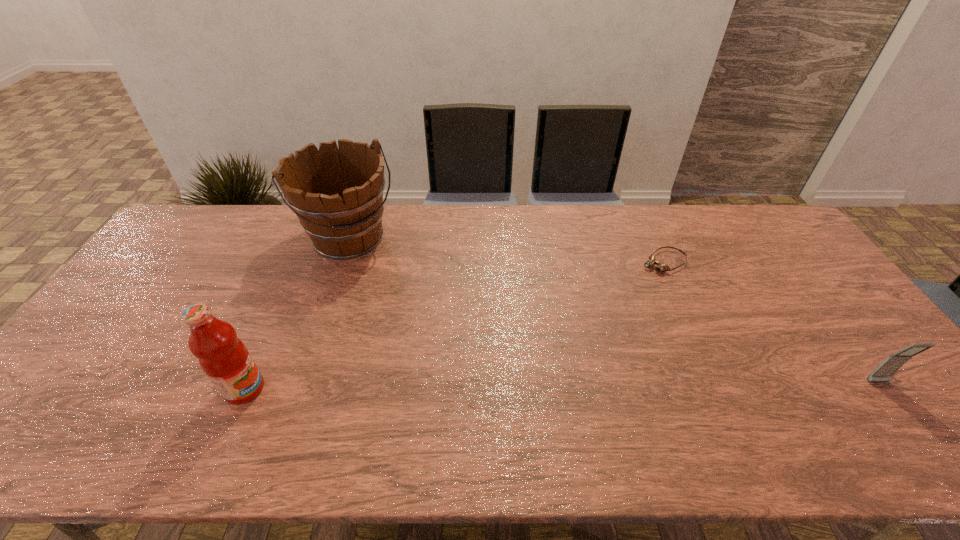
The height and width of the screenshot is (540, 960). Find the location of `free space between the wine bucket and the goggles`. free space between the wine bucket and the goggles is located at coordinates (507, 250).

You are a GUI agent. You are given a task and a screenshot of the screen. Output one action in this format:
    pyautogui.click(x=<x>, y=<y>)
    Task: Click on the free space between the wine bucket and the fruit juice
    The height and width of the screenshot is (540, 960).
    Given the screenshot: What is the action you would take?
    pyautogui.click(x=298, y=314)

This screenshot has height=540, width=960. Find the location of `vacant area between the wine bucket and the goggles`. vacant area between the wine bucket and the goggles is located at coordinates (507, 250).

What are the coordinates of `free space that is in between the goggles and the fruit juice` in the screenshot? It's located at (454, 325).

Select which object is the third closest to the fruit juice. Please provide its 2D coordinates. Your answer should be formatted as a tuple, i.e. [(x, y)], where the tuple contains the x and y coordinates of a point satisfying the conditions above.

[(883, 373)]

At what (x,y) coordinates should I click in order to perform the action: click on object that ranks as the closest to the third object from left to right. Please return your answer as a coordinate pair (x, y). The image size is (960, 540). Looking at the image, I should click on (883, 373).